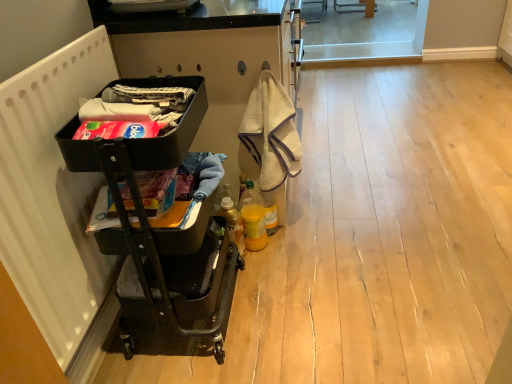
Locate an element on the screen. vacant space in front of translucent plastic bottle at center, the 2th bottle viewed from the left is located at coordinates (285, 254).